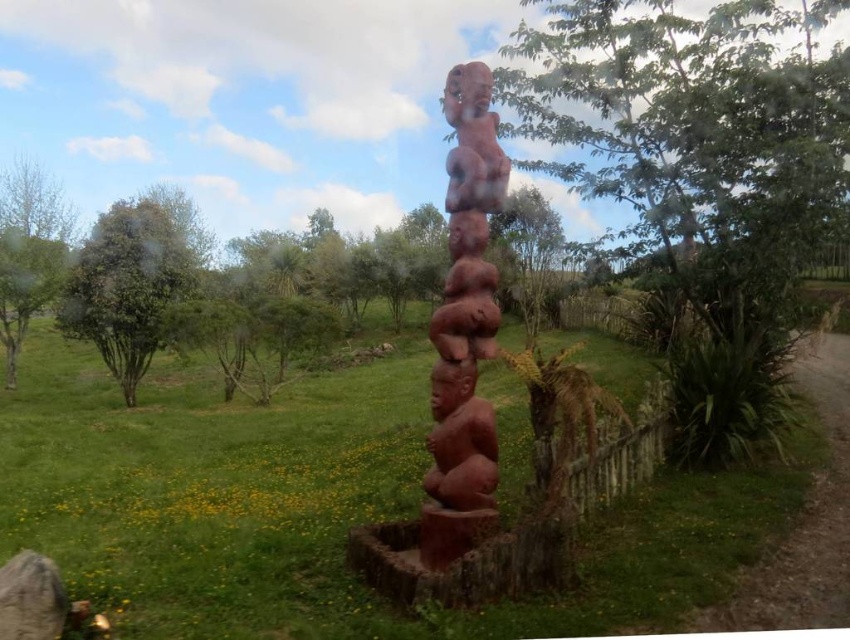
Question: Which object appears farthest from the camera in this image?

Choices:
 (A) matte reddish-brown totem pole at center
 (B) green leafy tree at center

Answer: (B)

Question: Which point is closer to the camera?

Choices:
 (A) green leafy tree at center
 (B) green grassy at center

Answer: (B)

Question: Can you confirm if green leafy tree at center is wider than matte reddish-brown totem pole at center?

Choices:
 (A) yes
 (B) no

Answer: (A)

Question: Which point is closer to the camera?

Choices:
 (A) green grassy at center
 (B) green leafy tree at center
 (C) matte reddish-brown totem pole at center

Answer: (A)

Question: Is green grassy at center positioned before green leafy tree at left?

Choices:
 (A) yes
 (B) no

Answer: (A)

Question: Is green leafy tree at center closer to the viewer compared to green leafy tree at left?

Choices:
 (A) no
 (B) yes

Answer: (B)